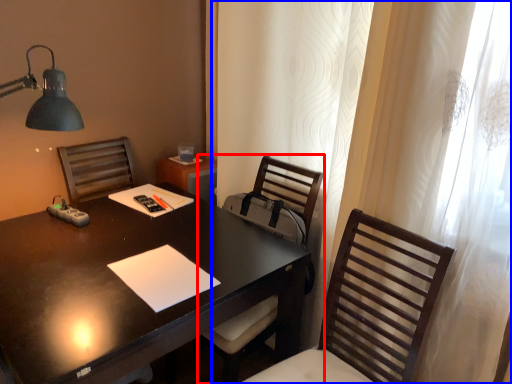
Question: Which of the following is the closest to the observer, chair (highlighted by a red box) or curtain (highlighted by a blue box)?

Choices:
 (A) chair
 (B) curtain

Answer: (B)